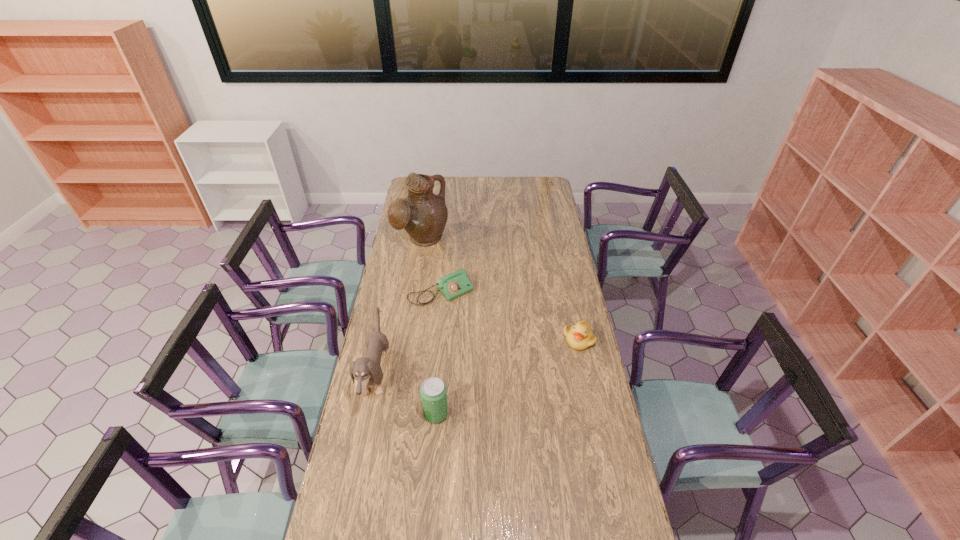
Where is `pitcher that is at the left edge`? The height and width of the screenshot is (540, 960). pitcher that is at the left edge is located at coordinates (423, 215).

The height and width of the screenshot is (540, 960). What are the coordinates of `puppy that is at the left edge` in the screenshot? It's located at 366,371.

You are a GUI agent. You are given a task and a screenshot of the screen. Output one action in this format:
    pyautogui.click(x=<x>, y=<y>)
    Task: Click on the object that is at the right edge
    The width and height of the screenshot is (960, 540).
    Given the screenshot: What is the action you would take?
    pyautogui.click(x=579, y=337)

Locate an element on the screen. This screenshot has height=540, width=960. free space at the far edge of the desktop is located at coordinates (512, 193).

Where is `vacant region at the near edge of the desktop`? vacant region at the near edge of the desktop is located at coordinates click(516, 536).

In the image, there is a desktop. Identify the location of vacant space at the left edge. This screenshot has height=540, width=960. (396, 269).

Identify the location of vacant space at the right edge of the desktop. (564, 247).

Locate an element on the screen. vacant area between the shortest object and the puppy is located at coordinates (409, 335).

Locate an element on the screen. The width and height of the screenshot is (960, 540). vacant space that is in between the pitcher and the shortest object is located at coordinates pyautogui.click(x=432, y=267).

Find the location of a particular element. free space that is in between the puppy and the rightmost object is located at coordinates (477, 358).